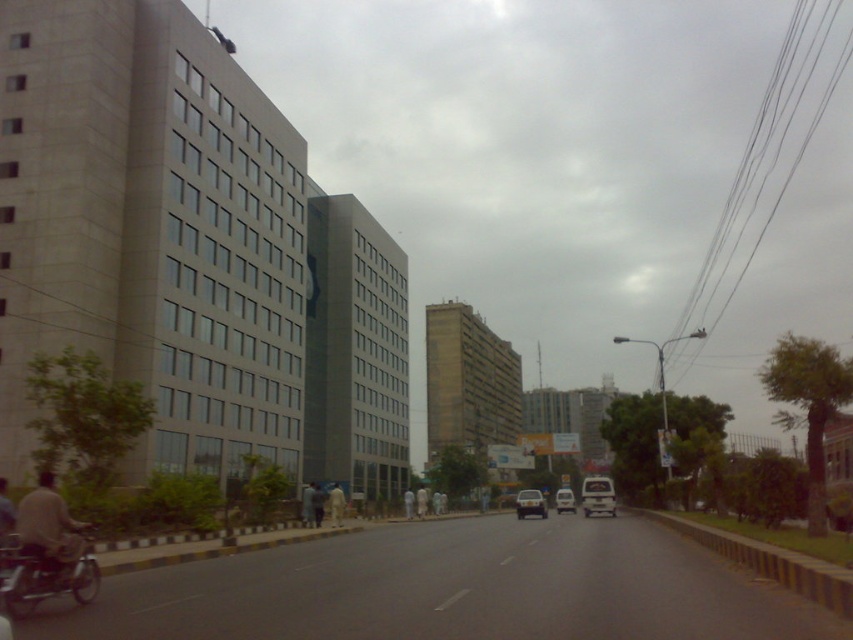
Does metallic silver motorcycle at lower left have a greater height compared to matte black car at center?

No.

Does point (96, 564) come behind point (527, 512)?

No, it is in front of (527, 512).

Find the location of `metallic silver motorcycle at lower left`. metallic silver motorcycle at lower left is located at coordinates (45, 573).

Who is taller, light brown leather jacket at lower left or white matte van at center?

With more height is white matte van at center.

Which is above, light brown leather jacket at lower left or white matte van at center?

light brown leather jacket at lower left is above.

Between point (51, 576) and point (572, 504), which one is positioned behind?

The point (572, 504) is behind.

This screenshot has width=853, height=640. What are the coordinates of `light brown leather jacket at lower left` in the screenshot? It's located at (49, 534).

Is metallic silver motorcycle at lower left in front of light brown leather jacket at lower left?

Yes, metallic silver motorcycle at lower left is in front of light brown leather jacket at lower left.

Between metallic silver motorcycle at lower left and light brown leather jacket at lower left, which one has less height?

metallic silver motorcycle at lower left

Where is `metallic silver motorcycle at lower left`? metallic silver motorcycle at lower left is located at coordinates (45, 573).

You are a GUI agent. You are given a task and a screenshot of the screen. Output one action in this format:
    pyautogui.click(x=<x>, y=<y>)
    Task: Click on the metallic silver motorcycle at lower left
    The width and height of the screenshot is (853, 640).
    Given the screenshot: What is the action you would take?
    pyautogui.click(x=45, y=573)